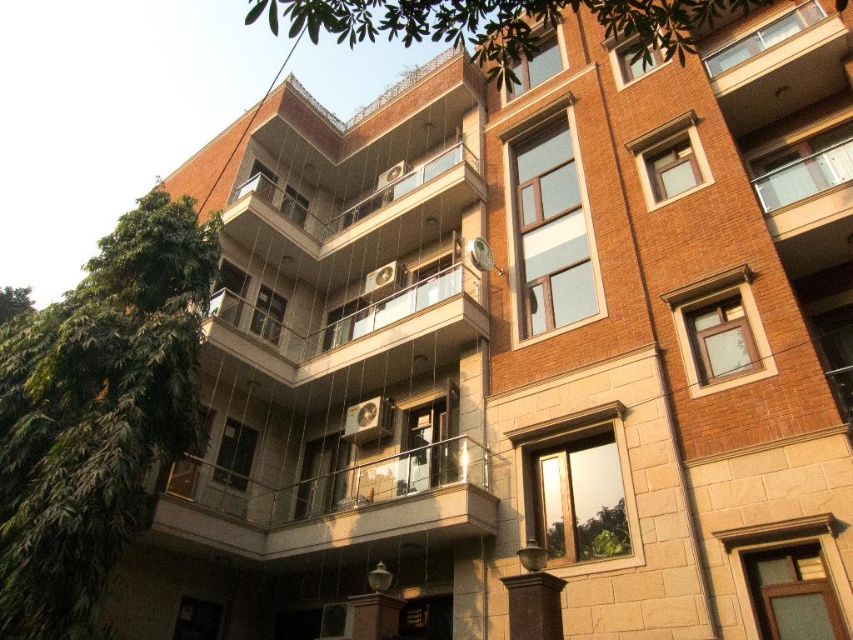
Question: Can you confirm if clear glass balcony at center is wider than green leafy tree at upper center?

Choices:
 (A) yes
 (B) no

Answer: (B)

Question: Which point appears closest to the camera in this image?

Choices:
 (A) (181, 378)
 (B) (436, 284)
 (C) (479, 44)

Answer: (C)

Question: Is green leafy tree at upper center to the left of glassy white balcony at center from the viewer's perspective?

Choices:
 (A) yes
 (B) no

Answer: (A)

Question: Among these points, which one is farthest from the camera?

Choices:
 (A) (387, 188)
 (B) (351, 476)
 (C) (9, 579)

Answer: (A)

Question: Among these points, which one is nearest to the camera?

Choices:
 (A) (689, 35)
 (B) (434, 157)

Answer: (A)

Question: Is green leafy tree at left to the right of glassy white balcony at center from the viewer's perspective?

Choices:
 (A) yes
 (B) no

Answer: (B)